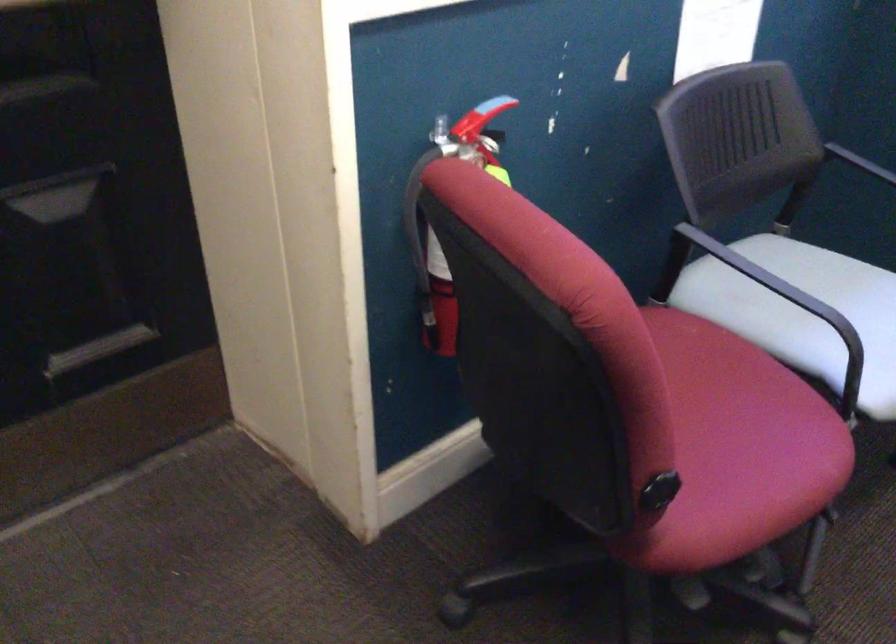
Where is `fire extinguisher handle`? This screenshot has height=644, width=896. fire extinguisher handle is located at coordinates (483, 114).